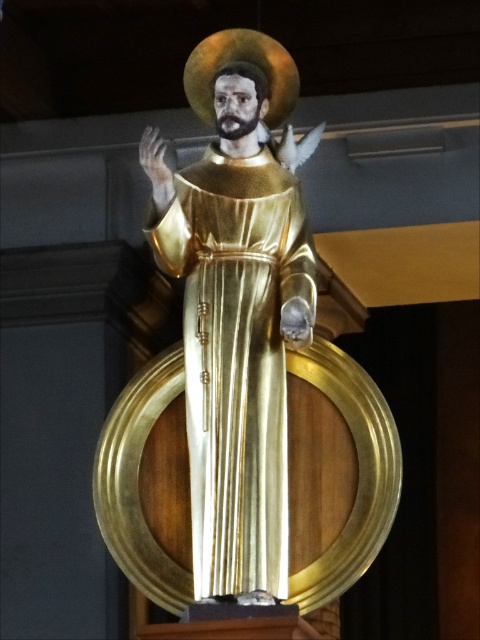
You are an art conservator examining the golden statue of a saint. You notice a specific point at coordinates (x=244, y=378). Based on the scene description, what does this point indicate?

The point at coordinates (x=244, y=378) marks the gold polished statue at center.

You are an art conservator examining the gold polished statue at center. You need to place a protective barrier around it. The barrier must be placed at a specific coordinate to ensure it doesn not block the view from the main entrance. The main entrance is located at coordinate point 0.592, 0.510. Is the barrier placement at coordinate point 0.592, 0.510 appropriate?

The gold polished statue at center is located at coordinate point (x=244, y=378). Placing the barrier at this exact coordinate would position it directly under the statue, potentially blocking the view from the main entrance. Therefore, the barrier placement at coordinate point (x=244, y=378) is not appropriate.